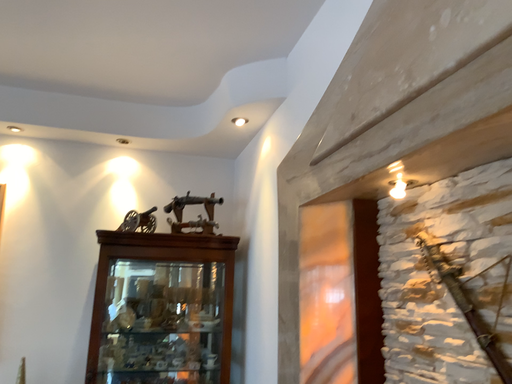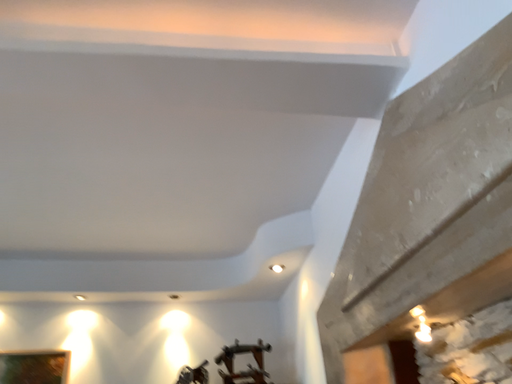
Question: How did the camera likely rotate when shooting the video?

Choices:
 (A) rotated downward
 (B) rotated upward

Answer: (B)